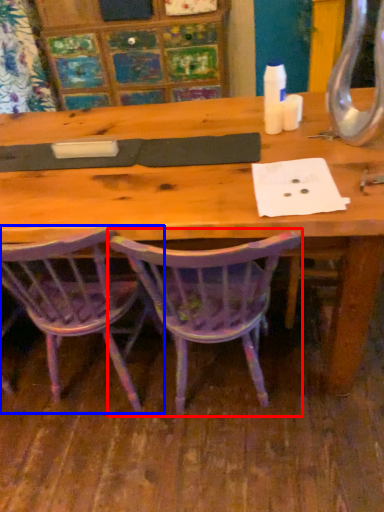
Question: Which object appears closest to the camera in this image, chair (highlighted by a red box) or chair (highlighted by a blue box)?

Choices:
 (A) chair
 (B) chair

Answer: (A)